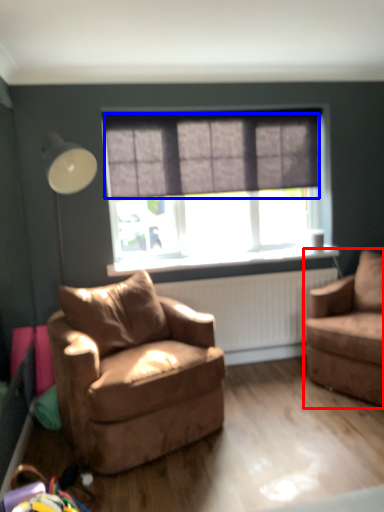
Question: Which of the following is the closest to the observer, chair (highlighted by a red box) or curtain (highlighted by a blue box)?

Choices:
 (A) chair
 (B) curtain

Answer: (A)